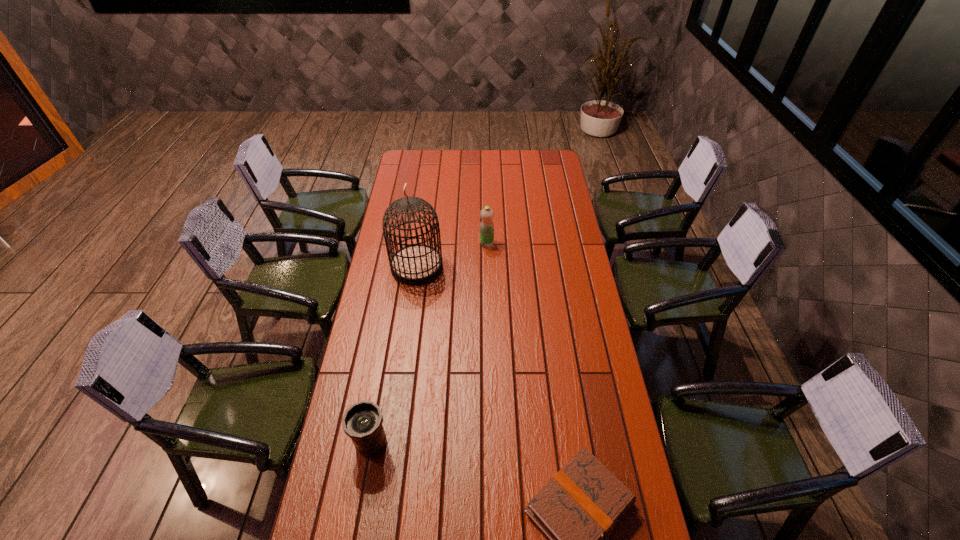
This screenshot has height=540, width=960. Find the location of `free space at the far edge of the desktop`. free space at the far edge of the desktop is located at coordinates (493, 152).

You are a GUI agent. You are given a task and a screenshot of the screen. Output one action in this format:
    pyautogui.click(x=<x>, y=<y>)
    Task: Click on the free space at the left edge of the desktop
    Image resolution: width=960 pixels, height=540 pixels.
    Given the screenshot: What is the action you would take?
    pyautogui.click(x=403, y=315)

What are the coordinates of `free space at the right edge` in the screenshot? It's located at (547, 189).

In the image, there is a desktop. At what (x,y) coordinates should I click in order to perform the action: click on free space at the far left corner. Please return your answer as a coordinate pair (x, y). The height and width of the screenshot is (540, 960). Looking at the image, I should click on pyautogui.click(x=423, y=164).

Image resolution: width=960 pixels, height=540 pixels. I want to click on vacant region between the water bottle and the third tallest object, so click(x=429, y=343).

Locate an element on the screen. The image size is (960, 540). blank region between the third shortest object and the telephoto lens is located at coordinates (429, 343).

You are a GUI agent. You are given a task and a screenshot of the screen. Output one action in this format:
    pyautogui.click(x=<x>, y=<y>)
    Task: Click on the blank region between the second farthest object and the third tallest object
    
    Given the screenshot: What is the action you would take?
    pyautogui.click(x=395, y=355)

The height and width of the screenshot is (540, 960). I want to click on vacant space in between the birdcage and the farthest object, so click(x=452, y=255).

In order to click on empty space between the third nearest object and the telephoto lens in this screenshot , I will do `click(395, 355)`.

Identify the location of free spot between the telephoto lens and the birdcage. This screenshot has height=540, width=960. (395, 355).